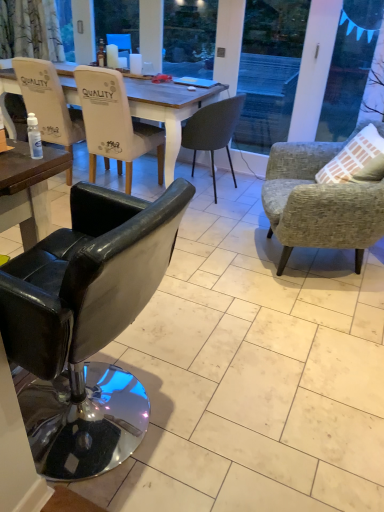
The image size is (384, 512). What do you see at coordinates (135, 64) in the screenshot?
I see `white glossy coffee cup at upper center` at bounding box center [135, 64].

Locate an element on the screen. white glossy coffee cup at upper center is located at coordinates (135, 64).

How much space does white leather chair at left, placed as the first chair when sorted from left to right, occupy vertically?

38.24 inches.

At what (x,y) coordinates should I click in order to perform the action: click on black leather chair at left, arranged as the third chair when viewed from the right. Please return your answer as a coordinate pair (x, y). The width and height of the screenshot is (384, 512). Looking at the image, I should click on (86, 323).

I want to click on textured gray armchair at right, which is the first chair from right to left, so (319, 202).

Where is `white glossy coffee cup at upper center`? white glossy coffee cup at upper center is located at coordinates (135, 64).

Is textured gray armchair at right, which is the first chair from right to left, placed right next to white leather chair at left, placed as the first chair when sorted from left to right?

textured gray armchair at right, which is the first chair from right to left, is not next to white leather chair at left, placed as the first chair when sorted from left to right, and they're not touching.

From the image's perspective, which object appears higher, textured gray armchair at right, which is the first chair from right to left, or white leather chair at left, placed as the first chair when sorted from left to right?

white leather chair at left, placed as the first chair when sorted from left to right, from the image's perspective.

From a real-world perspective, is textured gray armchair at right, which is the first chair from right to left, above or below white leather chair at left, placed as the first chair when sorted from left to right?

Clearly, from a real-world perspective, textured gray armchair at right, which is the first chair from right to left, is below white leather chair at left, placed as the first chair when sorted from left to right.

Between textured gray armchair at right, which is the fifth chair in left-to-right order, and white leather chair at left, placed as the first chair when sorted from left to right, which one is positioned in front?

textured gray armchair at right, which is the fifth chair in left-to-right order, is in front.

Does matte black chair at center, arranged as the second chair when viewed from the right, turn towards white glossy coffee cup at upper center?

Yes, matte black chair at center, arranged as the second chair when viewed from the right, is facing white glossy coffee cup at upper center.

Consider the image. How many degrees apart are the facing directions of matte black chair at center, arranged as the second chair when viewed from the right, and white glossy coffee cup at upper center?

matte black chair at center, arranged as the second chair when viewed from the right, and white glossy coffee cup at upper center are facing 90 degrees away from each other.

Is there a large distance between matte black chair at center, the 4th chair from the left, and white glossy coffee cup at upper center?

matte black chair at center, the 4th chair from the left, is far away from white glossy coffee cup at upper center.

Which of these two, matte black chair at center, the 4th chair from the left, or white glossy coffee cup at upper center, stands taller?

With more height is matte black chair at center, the 4th chair from the left.

Which of these two, matte black chair at center, the 4th chair from the left, or textured gray armchair at right, which is the first chair from right to left, is thinner?

Thinner between the two is matte black chair at center, the 4th chair from the left.

Consider the image. Does matte black chair at center, the 4th chair from the left, have a larger size compared to textured gray armchair at right, which is the first chair from right to left?

No, matte black chair at center, the 4th chair from the left, is not bigger than textured gray armchair at right, which is the first chair from right to left.

Measure the distance between matte black chair at center, arranged as the second chair when viewed from the right, and textured gray armchair at right, which is the fifth chair in left-to-right order.

A distance of 38.55 inches exists between matte black chair at center, arranged as the second chair when viewed from the right, and textured gray armchair at right, which is the fifth chair in left-to-right order.

Considering the points (241, 105) and (326, 216), which point is behind, point (241, 105) or point (326, 216)?

The point (241, 105) is more distant.

Which of these two, white glossy coffee cup at upper center or matte black chair at center, the 4th chair from the left, stands taller?

matte black chair at center, the 4th chair from the left.

Between white glossy coffee cup at upper center and matte black chair at center, the 4th chair from the left, which one has smaller width?

With smaller width is white glossy coffee cup at upper center.

From the image's perspective, which is below, white glossy coffee cup at upper center or matte black chair at center, the 4th chair from the left?

matte black chair at center, the 4th chair from the left, appears lower in the image.

This screenshot has width=384, height=512. In order to click on coffee cup located above the matte black chair at center, the 4th chair from the left (from the image's perspective) in this screenshot , I will do `click(135, 64)`.

Which is correct: black leather chair at left, which ranks as the third chair in left-to-right order, is inside white leather chair at upper left, the fourth chair from the right, or outside of it?

black leather chair at left, which ranks as the third chair in left-to-right order, is not inside white leather chair at upper left, the fourth chair from the right, it's outside.

Is point (98, 238) in front of point (101, 126)?

Yes, it is in front of point (101, 126).

Considering the relative sizes of black leather chair at left, arranged as the third chair when viewed from the right, and white leather chair at upper left, the fourth chair from the right, in the image provided, is black leather chair at left, arranged as the third chair when viewed from the right, wider than white leather chair at upper left, the fourth chair from the right,?

No.

Does black leather chair at left, arranged as the third chair when viewed from the right, have a smaller size compared to white leather chair at upper left, which is the 2th chair from left to right?

No, black leather chair at left, arranged as the third chair when viewed from the right, is not smaller than white leather chair at upper left, which is the 2th chair from left to right.

This screenshot has width=384, height=512. In order to click on the 2nd chair counting from the right of the white leather chair at left, placed as the 5th chair when sorted from right to left in this screenshot , I will do `click(86, 323)`.

From a real-world perspective, is white leather chair at left, placed as the first chair when sorted from left to right, on black leather chair at left, arranged as the third chair when viewed from the right?

Indeed, from a real-world perspective, white leather chair at left, placed as the first chair when sorted from left to right, stands above black leather chair at left, arranged as the third chair when viewed from the right.

Could you tell me if white leather chair at left, placed as the first chair when sorted from left to right, is facing black leather chair at left, which ranks as the third chair in left-to-right order?

No.

Considering the sizes of objects white leather chair at left, placed as the first chair when sorted from left to right, and black leather chair at left, arranged as the third chair when viewed from the right, in the image provided, who is wider, white leather chair at left, placed as the first chair when sorted from left to right, or black leather chair at left, arranged as the third chair when viewed from the right,?

white leather chair at left, placed as the first chair when sorted from left to right, is wider.

This screenshot has width=384, height=512. There is a white glossy coffee cup at upper center. What are the coordinates of `the 2nd chair below it (from a real-world perspective)` in the screenshot? It's located at (48, 102).

Considering the relative sizes of white leather chair at left, placed as the first chair when sorted from left to right, and white glossy coffee cup at upper center in the image provided, is white leather chair at left, placed as the first chair when sorted from left to right, shorter than white glossy coffee cup at upper center?

No, white leather chair at left, placed as the first chair when sorted from left to right, is not shorter than white glossy coffee cup at upper center.

Does point (83, 129) come behind point (129, 62)?

No.

From a real-world perspective, is white leather chair at left, placed as the first chair when sorted from left to right, physically above white glossy coffee cup at upper center?

No, from a real-world perspective, white leather chair at left, placed as the first chair when sorted from left to right, is not over white glossy coffee cup at upper center

Locate an element on the screen. the 3rd chair below the white leather chair at left, placed as the 5th chair when sorted from right to left (from a real-world perspective) is located at coordinates (319, 202).

I want to click on coffee cup behind the matte black chair at center, the 4th chair from the left, so click(135, 64).

Estimate the real-world distances between objects in this image. Which object is further from transparent plastic bottle at lower left, matte black chair at center, the 4th chair from the left, or white leather chair at left, placed as the 5th chair when sorted from right to left?

matte black chair at center, the 4th chair from the left, lies further to transparent plastic bottle at lower left than the other object.

Based on their spatial positions, is white leather chair at upper left, which is the 2th chair from left to right, or black leather chair at left, arranged as the third chair when viewed from the right, closer to transparent plastic bottle at lower left?

The object closer to transparent plastic bottle at lower left is white leather chair at upper left, which is the 2th chair from left to right.

When comparing their distances from textured gray armchair at right, which is the fifth chair in left-to-right order, does transparent plastic bottle at lower left or white leather chair at upper left, which is the 2th chair from left to right, seem closer?

Based on the image, white leather chair at upper left, which is the 2th chair from left to right, appears to be nearer to textured gray armchair at right, which is the fifth chair in left-to-right order.

When comparing their distances from white glossy coffee cup at upper center, does white leather chair at upper left, the fourth chair from the right, or transparent plastic bottle at lower left seem further?

The object further to white glossy coffee cup at upper center is transparent plastic bottle at lower left.

Based on their spatial positions, is matte black chair at center, arranged as the second chair when viewed from the right, or white leather chair at upper left, which is the 2th chair from left to right, further from textured gray armchair at right, which is the fifth chair in left-to-right order?

white leather chair at upper left, which is the 2th chair from left to right, is further to textured gray armchair at right, which is the fifth chair in left-to-right order.

Estimate the real-world distances between objects in this image. Which object is closer to white leather chair at left, placed as the first chair when sorted from left to right, white leather chair at upper left, the fourth chair from the right, or textured gray armchair at right, which is the first chair from right to left?

Based on the image, white leather chair at upper left, the fourth chair from the right, appears to be nearer to white leather chair at left, placed as the first chair when sorted from left to right.

Considering their positions, is matte black chair at center, arranged as the second chair when viewed from the right, positioned closer to white leather chair at upper left, the fourth chair from the right, than black leather chair at left, which ranks as the third chair in left-to-right order?

matte black chair at center, arranged as the second chair when viewed from the right.

Looking at the image, which one is located further to white leather chair at left, placed as the 5th chair when sorted from right to left, textured gray armchair at right, which is the first chair from right to left, or white leather chair at upper left, which is the 2th chair from left to right?

textured gray armchair at right, which is the first chair from right to left, is positioned further to the anchor white leather chair at left, placed as the 5th chair when sorted from right to left.

This screenshot has height=512, width=384. In order to click on bottle between white leather chair at upper left, which is the 2th chair from left to right, and textured gray armchair at right, which is the first chair from right to left, from left to right in this screenshot , I will do `click(34, 137)`.

Where is `bottle positioned between black leather chair at left, arranged as the third chair when viewed from the right, and white glossy coffee cup at upper center from near to far`? Image resolution: width=384 pixels, height=512 pixels. bottle positioned between black leather chair at left, arranged as the third chair when viewed from the right, and white glossy coffee cup at upper center from near to far is located at coordinates (34, 137).

Find the location of a particular element. The width and height of the screenshot is (384, 512). bottle positioned between black leather chair at left, arranged as the third chair when viewed from the right, and matte black chair at center, arranged as the second chair when viewed from the right, from near to far is located at coordinates (34, 137).

Where is `bottle positioned between black leather chair at left, which ranks as the third chair in left-to-right order, and white leather chair at upper left, which is the 2th chair from left to right, from near to far`? The image size is (384, 512). bottle positioned between black leather chair at left, which ranks as the third chair in left-to-right order, and white leather chair at upper left, which is the 2th chair from left to right, from near to far is located at coordinates (34, 137).